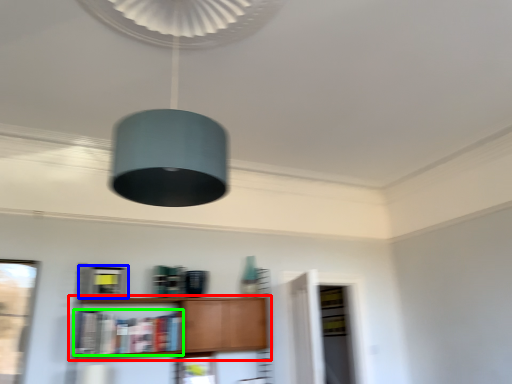
Question: Which object is positioned farthest from shelf (highlighted by a red box)? Select from cabinetry (highlighted by a blue box) and book (highlighted by a green box).

Choices:
 (A) cabinetry
 (B) book

Answer: (A)